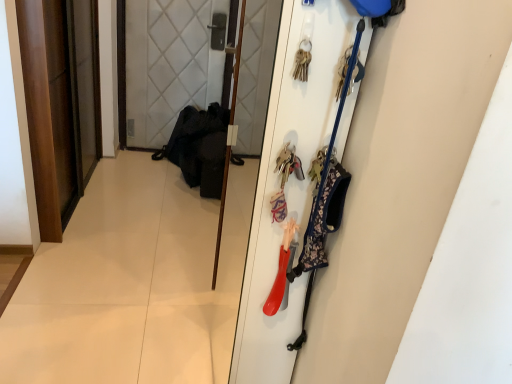
Identify the location of vacant space underneath wooden screen door at center (from a real-world perspective). (226, 231).